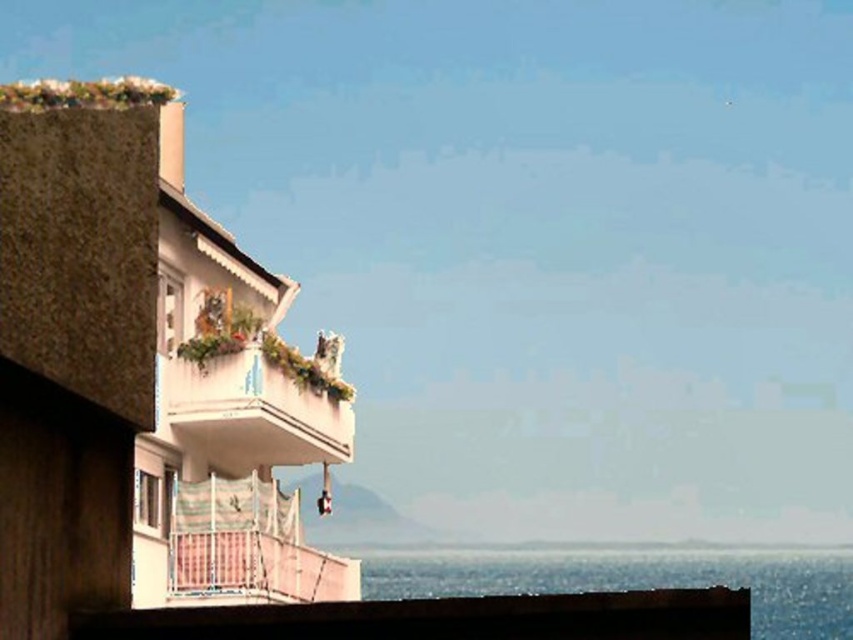
Question: Which of these objects is positioned farthest from the white textured balcony at upper center?

Choices:
 (A) blue water at lower right
 (B) smooth concrete ledge at lower center

Answer: (A)

Question: Which point is farther to the camera?

Choices:
 (A) blue water at lower right
 (B) smooth concrete ledge at lower center
 (C) white textured balcony at upper center

Answer: (A)

Question: Does blue water at lower right have a larger size compared to white textured balcony at upper center?

Choices:
 (A) no
 (B) yes

Answer: (B)

Question: Does smooth concrete ledge at lower center come behind white textured balcony at upper center?

Choices:
 (A) no
 (B) yes

Answer: (A)

Question: From the image, what is the correct spatial relationship of smooth concrete ledge at lower center in relation to blue water at lower right?

Choices:
 (A) right
 (B) left

Answer: (B)

Question: Which point is closer to the camera?

Choices:
 (A) smooth concrete ledge at lower center
 (B) blue water at lower right
 (C) white textured balcony at upper center

Answer: (A)